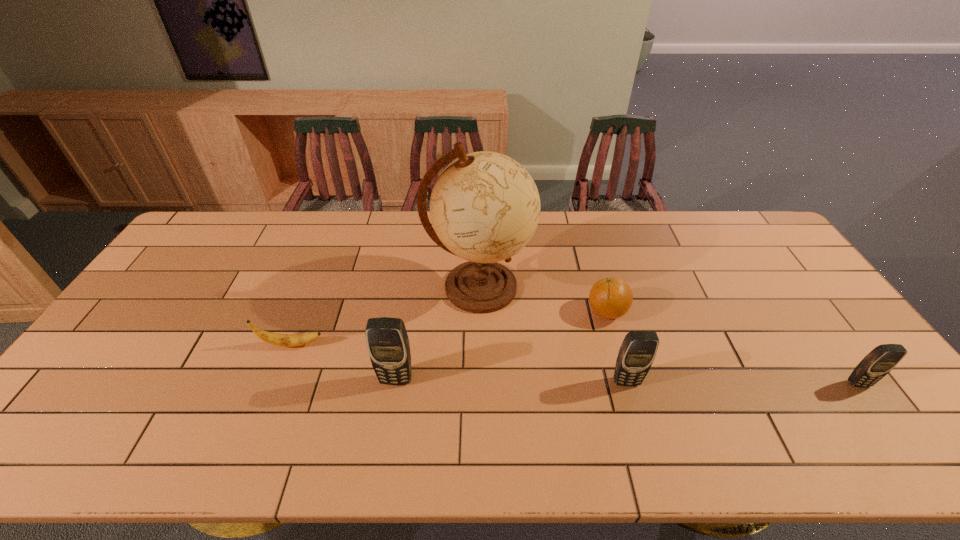
Find the location of a particular element. The image size is (960, 540). the fifth shortest object is located at coordinates (388, 346).

Locate an element on the screen. The height and width of the screenshot is (540, 960). the tallest cellular telephone is located at coordinates (388, 346).

Locate an element on the screen. The image size is (960, 540). the second shortest cellular telephone is located at coordinates (637, 352).

You are a GUI agent. You are given a task and a screenshot of the screen. Output one action in this format:
    pyautogui.click(x=<x>, y=<y>)
    Task: Click on the second cellular telephone from right to left
    The width and height of the screenshot is (960, 540).
    Given the screenshot: What is the action you would take?
    pyautogui.click(x=637, y=352)

The height and width of the screenshot is (540, 960). I want to click on the rightmost object, so click(882, 359).

Identify the location of the rightmost cellular telephone. The width and height of the screenshot is (960, 540). (882, 359).

The height and width of the screenshot is (540, 960). I want to click on the shortest object, so click(285, 340).

Where is `the fourth nearest object`? This screenshot has height=540, width=960. the fourth nearest object is located at coordinates (285, 340).

This screenshot has height=540, width=960. I want to click on orange, so coord(611,297).

At what (x,y) coordinates should I click in order to perform the action: click on globe. Please return your answer as a coordinate pair (x, y). This screenshot has height=540, width=960. Looking at the image, I should click on (485, 207).